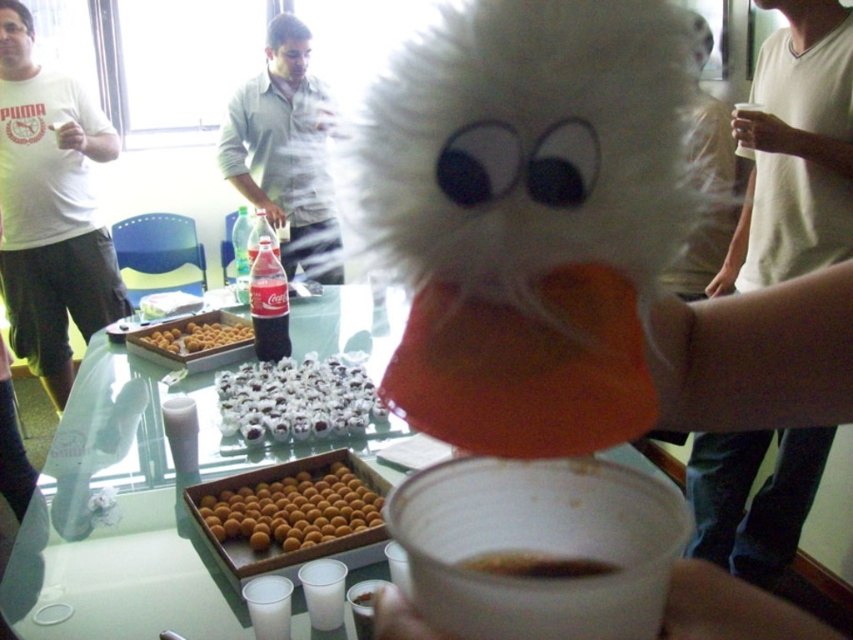
Question: Where is white cotton shirt at center located in relation to golden crispy balls at center in the image?

Choices:
 (A) above
 (B) below

Answer: (A)

Question: Which point is farther to the camera?

Choices:
 (A) white fluffy mask at upper center
 (B) white cotton shirt at center
 (C) golden crispy balls at center
 (D) coca-cola bottle at center

Answer: (B)

Question: Is orange matte/soft food at lower left smaller than white sugary candy at center?

Choices:
 (A) no
 (B) yes

Answer: (B)

Question: Which object is the farthest from the golden crispy balls at center?

Choices:
 (A) coca-cola bottle at center
 (B) white cotton shirt at center

Answer: (B)

Question: Which of the following is the farthest from the observer?

Choices:
 (A) (367, 488)
 (B) (210, 340)
 (C) (268, 273)
 (D) (265, 131)

Answer: (D)

Question: Can you confirm if white cotton shirt at center is thinner than orange matte/soft food at lower left?

Choices:
 (A) no
 (B) yes

Answer: (A)